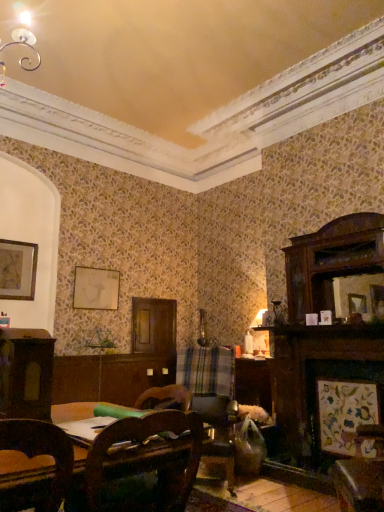
Question: Can you confirm if wooden framed artwork at upper left, the first picture frame positioned from the top, is taller than matte white picture frame at upper center, which is counted as the second picture frame, starting from the top?

Choices:
 (A) yes
 (B) no

Answer: (A)

Question: From a real-world perspective, is wooden framed artwork at upper left, which appears as the 3th picture frame when viewed from the front, below matte white picture frame at upper center, which is the fourth picture frame from front to back?

Choices:
 (A) yes
 (B) no

Answer: (B)

Question: Is wooden framed artwork at upper left, which is the second picture frame in back-to-front order, turned away from matte white picture frame at upper center, the 1th picture frame positioned from the back?

Choices:
 (A) yes
 (B) no

Answer: (B)

Question: Considering the relative sizes of wooden framed artwork at upper left, positioned as the first picture frame in left-to-right order, and matte white picture frame at upper center, the second picture frame in the left-to-right sequence, in the image provided, is wooden framed artwork at upper left, positioned as the first picture frame in left-to-right order, bigger than matte white picture frame at upper center, the second picture frame in the left-to-right sequence,?

Choices:
 (A) yes
 (B) no

Answer: (A)

Question: Is wooden framed artwork at upper left, positioned as the first picture frame in left-to-right order, not inside matte white picture frame at upper center, which is the fourth picture frame from front to back?

Choices:
 (A) yes
 (B) no

Answer: (A)

Question: Could matte white picture frame at upper center, the third picture frame viewed from the right, be considered to be inside wooden framed artwork at upper left, which is counted as the fourth picture frame, starting from the bottom?

Choices:
 (A) no
 (B) yes

Answer: (A)

Question: Is the position of matte white picture frame at upper center, which is the fourth picture frame from front to back, less distant than that of wooden chair at center?

Choices:
 (A) no
 (B) yes

Answer: (A)

Question: From the image's perspective, is matte white picture frame at upper center, the 1th picture frame positioned from the back, beneath wooden chair at center?

Choices:
 (A) no
 (B) yes

Answer: (A)

Question: Can you confirm if matte white picture frame at upper center, which is the fourth picture frame from front to back, is positioned to the left of wooden chair at center?

Choices:
 (A) no
 (B) yes

Answer: (B)

Question: Is matte white picture frame at upper center, which is the fourth picture frame from front to back, behind wooden chair at center?

Choices:
 (A) yes
 (B) no

Answer: (A)

Question: Is wooden chair at center located within matte white picture frame at upper center, the second picture frame in the left-to-right sequence?

Choices:
 (A) yes
 (B) no

Answer: (B)

Question: Is matte white picture frame at upper center, which is the fourth picture frame from front to back, at the right side of wooden chair at center?

Choices:
 (A) yes
 (B) no

Answer: (B)

Question: Would you consider wooden framed artwork at upper left, the 4th picture frame when ordered from right to left, to be distant from wooden framed artwork at lower right, which ranks as the 4th picture frame in back-to-front order?

Choices:
 (A) no
 (B) yes

Answer: (B)